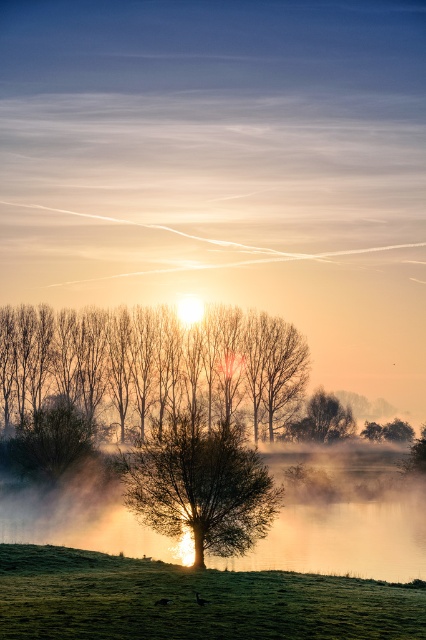
Can you confirm if green grassy field at lower center is positioned above smooth brown tree at left?

No, green grassy field at lower center is not above smooth brown tree at left.

Locate an element on the screen. green grassy field at lower center is located at coordinates (192, 600).

Identify the location of green grassy field at lower center. This screenshot has width=426, height=640. (192, 600).

I want to click on green grassy field at lower center, so click(192, 600).

What do you see at coordinates (201, 486) in the screenshot? Image resolution: width=426 pixels, height=640 pixels. I see `green leafy tree at center` at bounding box center [201, 486].

Is green leafy tree at center smaller than smooth brown tree at left?

Correct, green leafy tree at center occupies less space than smooth brown tree at left.

This screenshot has width=426, height=640. What do you see at coordinates (201, 486) in the screenshot?
I see `green leafy tree at center` at bounding box center [201, 486].

Where is `green leafy tree at center`? The height and width of the screenshot is (640, 426). green leafy tree at center is located at coordinates (201, 486).

Is green grassy field at lower center above green leafy tree at center?

Incorrect, green grassy field at lower center is not positioned above green leafy tree at center.

Does green grassy field at lower center appear on the left side of green leafy tree at center?

Incorrect, green grassy field at lower center is not on the left side of green leafy tree at center.

Between point (317, 627) and point (187, 460), which one is positioned in front?

Point (317, 627) is in front.

At what (x,y) coordinates should I click in order to perform the action: click on green grassy field at lower center. Please return your answer as a coordinate pair (x, y). Looking at the image, I should click on (192, 600).